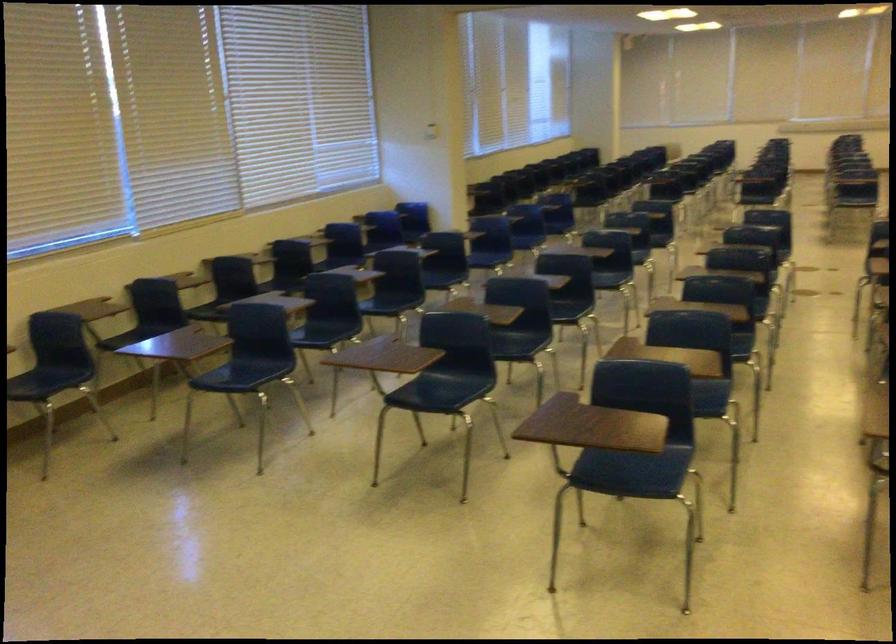
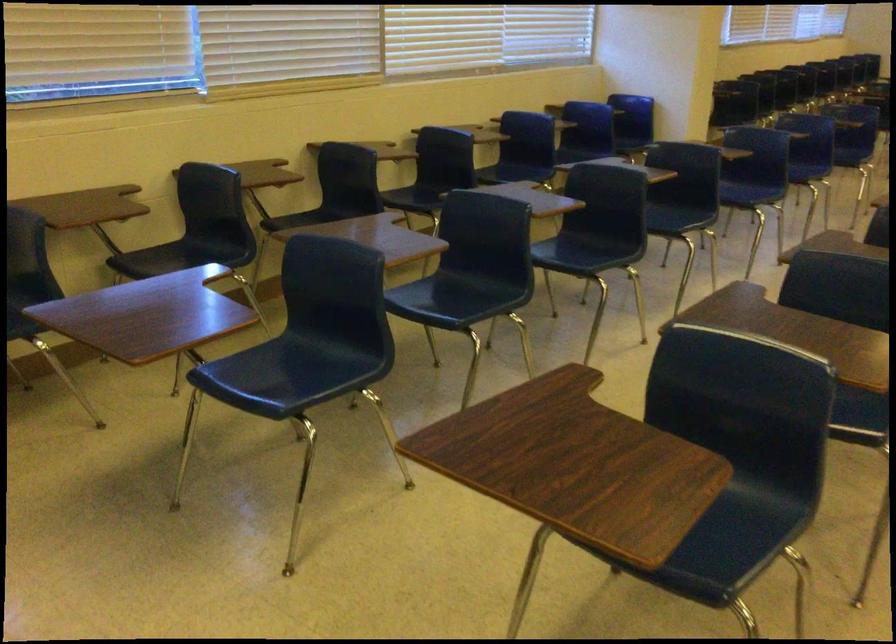
Find the pixel in the second image that matches (x=322, y=330) in the first image.

(462, 292)